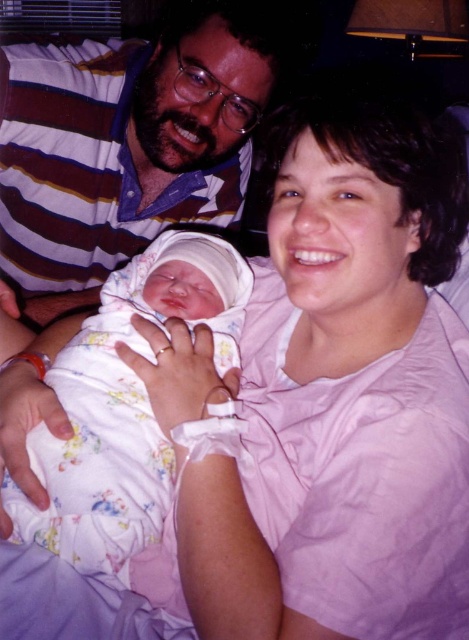
Question: Observing the image, what is the correct spatial positioning of matte striped shirt at upper left in reference to floral cotton swaddle at center?

Choices:
 (A) above
 (B) below

Answer: (A)

Question: Is matte striped shirt at upper left smaller than floral cotton swaddle at center?

Choices:
 (A) yes
 (B) no

Answer: (B)

Question: Observing the image, what is the correct spatial positioning of matte striped shirt at upper left in reference to floral cotton swaddle at center?

Choices:
 (A) left
 (B) right

Answer: (A)

Question: Which point appears closest to the camera in this image?

Choices:
 (A) (156, 477)
 (B) (110, 56)

Answer: (A)

Question: Which point is closer to the camera?

Choices:
 (A) matte striped shirt at upper left
 (B) floral cotton swaddle at center

Answer: (B)